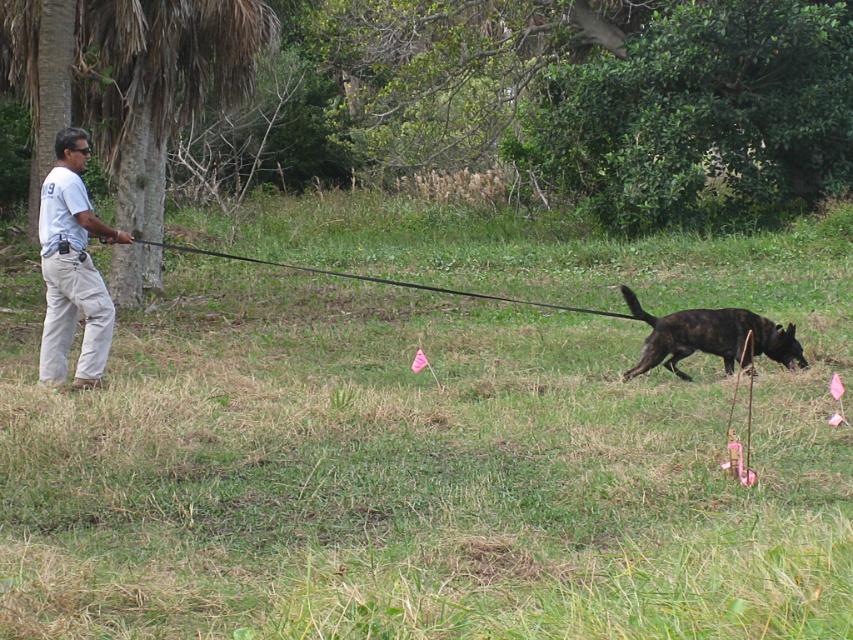
You are standing at the point marked by coordinates point [431,442]. The man with the light shirt and the dog are approaching you. Which direction should you move to avoid them?

The man and the dog are approaching from the direction of the green grassy area at center, so you should move away from the green grassy area at center to avoid them.

You are standing at the point labeled point (70, 296) and want to walk to point (688, 342). Which direction should you move to get closer to your destination?

You should move towards the upper right direction because point (688, 342) is located at a higher vertical position and further to the right compared to point (70, 296).

You are a person standing in the middle of the green grassy at center and looking towards the white cotton shirt at left. Which object is taller?

The green grassy at center is taller than the white cotton shirt at left.